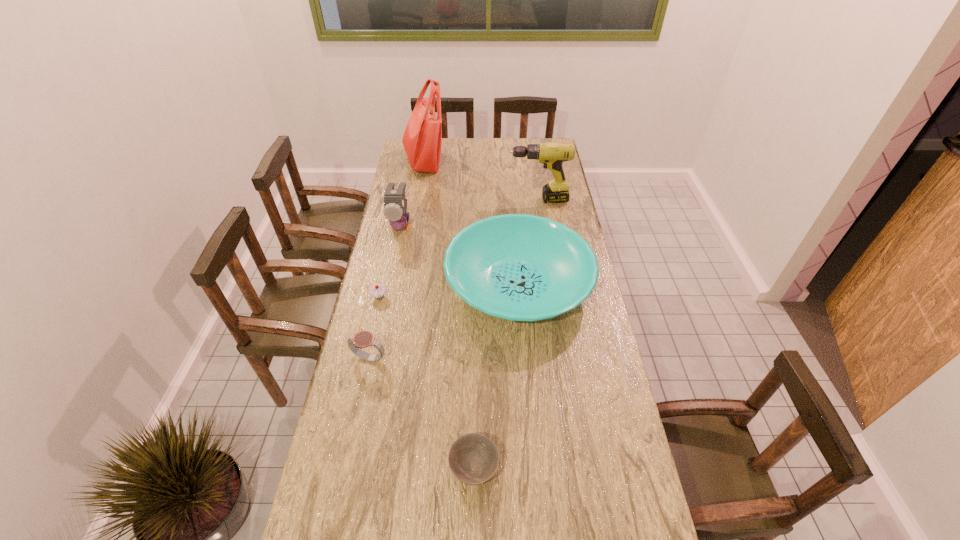
This screenshot has width=960, height=540. What are the coordinates of `handbag that is at the left edge` in the screenshot? It's located at (422, 139).

Where is `bird situated at the left edge`? bird situated at the left edge is located at coordinates 395,203.

At what (x,y) coordinates should I click in order to perform the action: click on watch at the left edge. Please return your answer as a coordinate pair (x, y). Looking at the image, I should click on (363, 339).

Find the location of a particular element. cupcake that is at the left edge is located at coordinates (377, 291).

Locate an element on the screen. drill situated at the right edge is located at coordinates (552, 154).

Find the location of a particular element. The image size is (960, 540). dish positioned at the right edge is located at coordinates click(519, 267).

This screenshot has width=960, height=540. I want to click on object positioned at the far left corner, so click(x=422, y=139).

I want to click on free point at the far edge, so click(x=516, y=160).

Image resolution: width=960 pixels, height=540 pixels. In the image, there is a desktop. Find the location of `free space at the left edge`. free space at the left edge is located at coordinates 395,328.

This screenshot has width=960, height=540. What are the coordinates of `vacant space at the right edge of the desktop` in the screenshot? It's located at (587, 323).